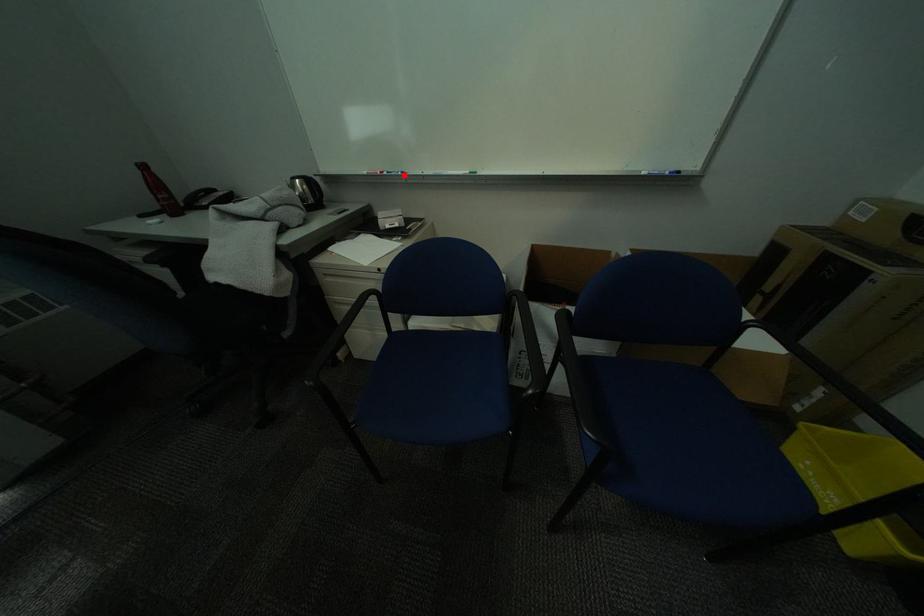
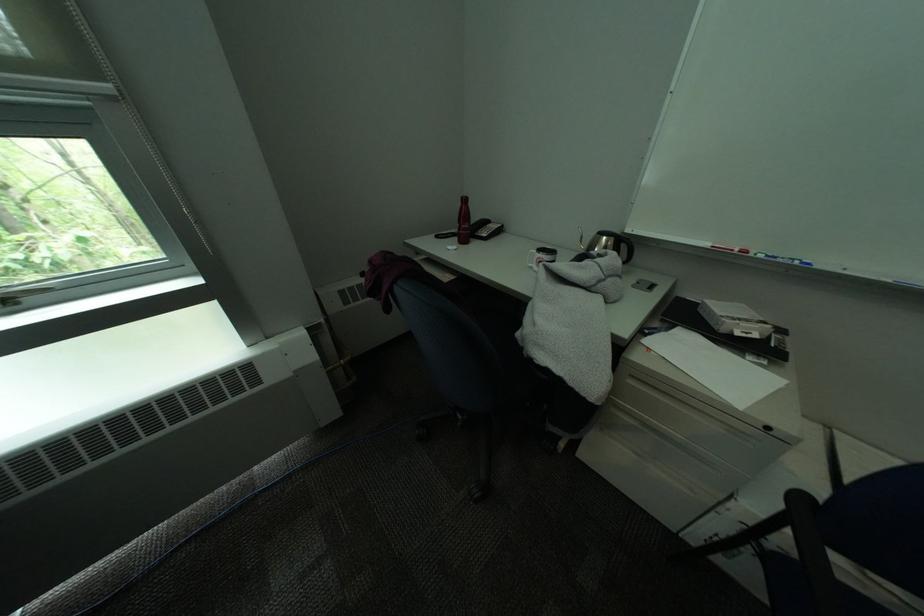
Question: I am providing you with two images of the same scene from different viewpoints. Image1 has a red point marked. In image2, the corresponding 3D location appears at what relative position? Reply with the corresponding letter.

Choices:
 (A) Closer
 (B) Farther

Answer: (B)